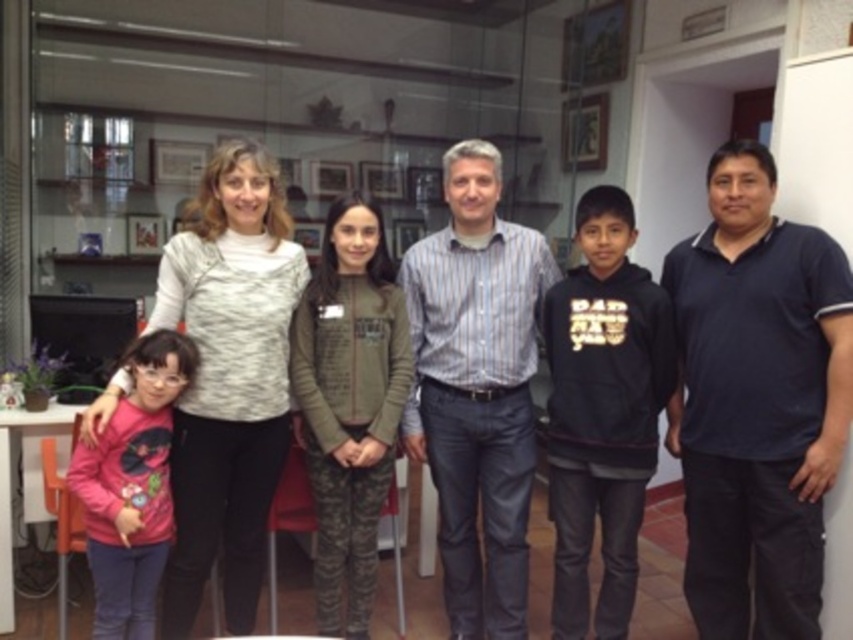
Question: Can you confirm if dark blue polo shirt at right is positioned above pink matte shirt at left?

Choices:
 (A) no
 (B) yes

Answer: (A)

Question: Is pink fabric shirt at left wider than pink fabric at left?

Choices:
 (A) yes
 (B) no

Answer: (B)

Question: Among these objects, which one is nearest to the camera?

Choices:
 (A) pink fabric at left
 (B) pink matte shirt at left
 (C) pink fabric shirt at left

Answer: (A)

Question: Which object is closer to the camera taking this photo?

Choices:
 (A) striped cotton shirt at center
 (B) pink matte shirt at left
 (C) pink fabric at left
 (D) dark blue polo shirt at right

Answer: (D)

Question: Can you confirm if pink matte shirt at left is bigger than pink fabric at left?

Choices:
 (A) yes
 (B) no

Answer: (A)

Question: Among these objects, which one is farthest from the camera?

Choices:
 (A) pink fabric shirt at left
 (B) pink fabric at left

Answer: (A)